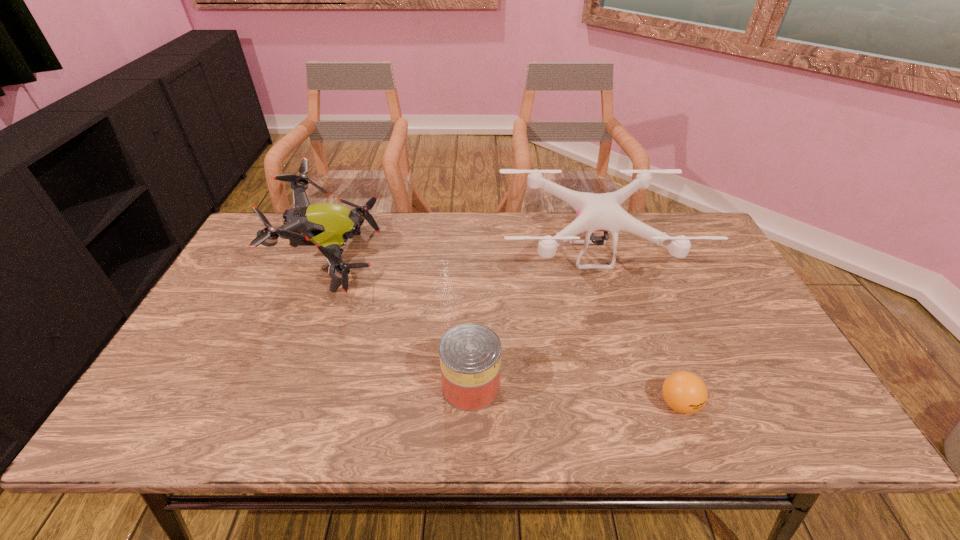
Identify the location of can located in the near edge section of the desktop. The image size is (960, 540). (470, 354).

Image resolution: width=960 pixels, height=540 pixels. Find the location of `ping-pong ball at the near edge`. ping-pong ball at the near edge is located at coordinates (684, 392).

Identify the location of object positioned at the left edge. The image size is (960, 540). (328, 226).

Find the location of a particular element. This screenshot has height=540, width=960. object that is at the right edge is located at coordinates (595, 212).

At what (x,y) coordinates should I click in order to perform the action: click on object situated at the far left corner. Please return your answer as a coordinate pair (x, y). Looking at the image, I should click on (328, 226).

At what (x,y) coordinates should I click in order to perform the action: click on object situated at the far right corner. Please return your answer as a coordinate pair (x, y). Looking at the image, I should click on (x=595, y=212).

In the image, there is a desktop. Identify the location of vacant space at the far edge. This screenshot has height=540, width=960. (633, 254).

This screenshot has width=960, height=540. I want to click on blank space at the near edge of the desktop, so click(x=228, y=430).

Find the location of a particular element. The width and height of the screenshot is (960, 540). vacant point at the left edge is located at coordinates (218, 297).

In order to click on vacant point at the right edge in this screenshot , I will do `click(739, 365)`.